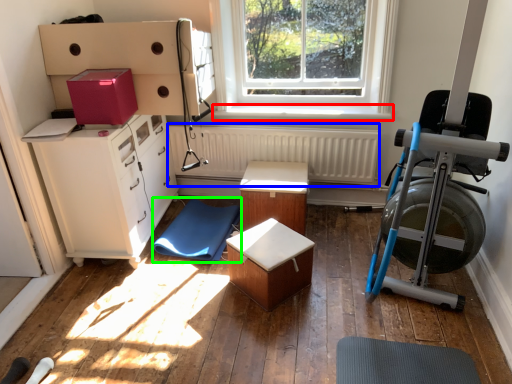
Question: Which object is the farthest from window sill (highlighted by a red box)? Choose among these: radiator (highlighted by a blue box) or yoga mat (highlighted by a green box).

Choices:
 (A) radiator
 (B) yoga mat

Answer: (B)